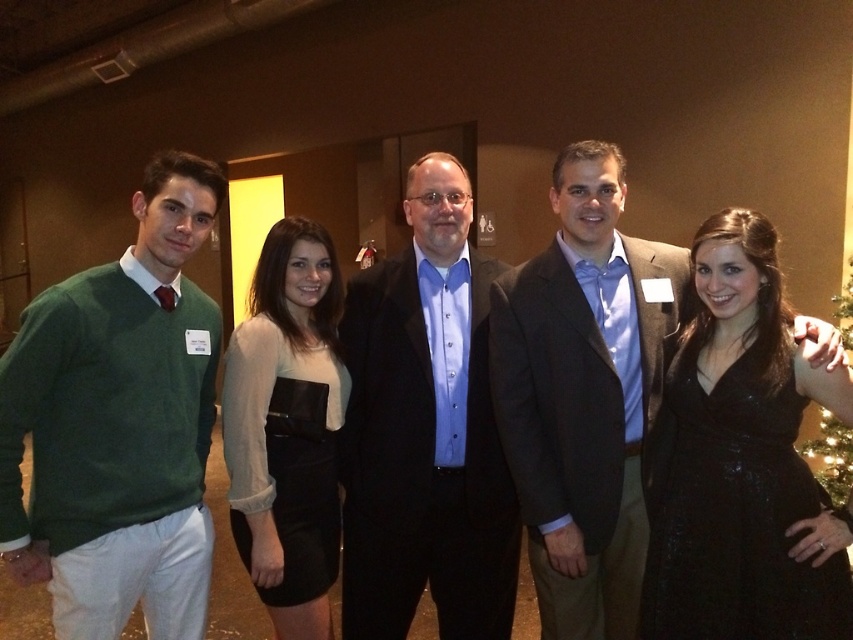
Between green sweater at left and green artificial christmas tree at right, which one is positioned higher?

green sweater at left is higher up.

Does green sweater at left appear under green artificial christmas tree at right?

No.

Does point (155, 179) lie in front of point (850, 300)?

That is True.

At what (x,y) coordinates should I click in order to perform the action: click on green sweater at left. Please return your answer as a coordinate pair (x, y). Looking at the image, I should click on (119, 422).

Does matte brown suit at center have a smaller size compared to black satin dress at center?

No, matte brown suit at center is not smaller than black satin dress at center.

Consider the image. Can you confirm if matte brown suit at center is thinner than black satin dress at center?

In fact, matte brown suit at center might be wider than black satin dress at center.

Does point (511, 440) lie behind point (306, 531)?

No, (511, 440) is closer to viewer.

The image size is (853, 640). Find the location of `matte brown suit at center`. matte brown suit at center is located at coordinates (584, 394).

Is green sweater at left to the right of matte brown suit at center from the viewer's perspective?

Incorrect, green sweater at left is not on the right side of matte brown suit at center.

Which is below, green sweater at left or matte brown suit at center?

Positioned lower is matte brown suit at center.

Which is behind, point (219, 324) or point (601, 608)?

The point (601, 608) is behind.

Find the location of `green sweater at left`. green sweater at left is located at coordinates (119, 422).